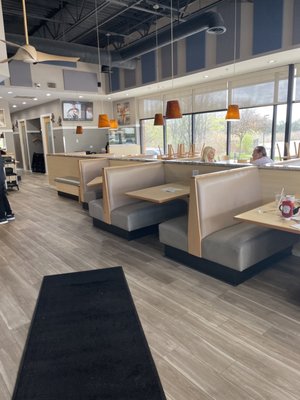
What are the coordinates of `ceiling fan` in the screenshot? It's located at point(37,52).